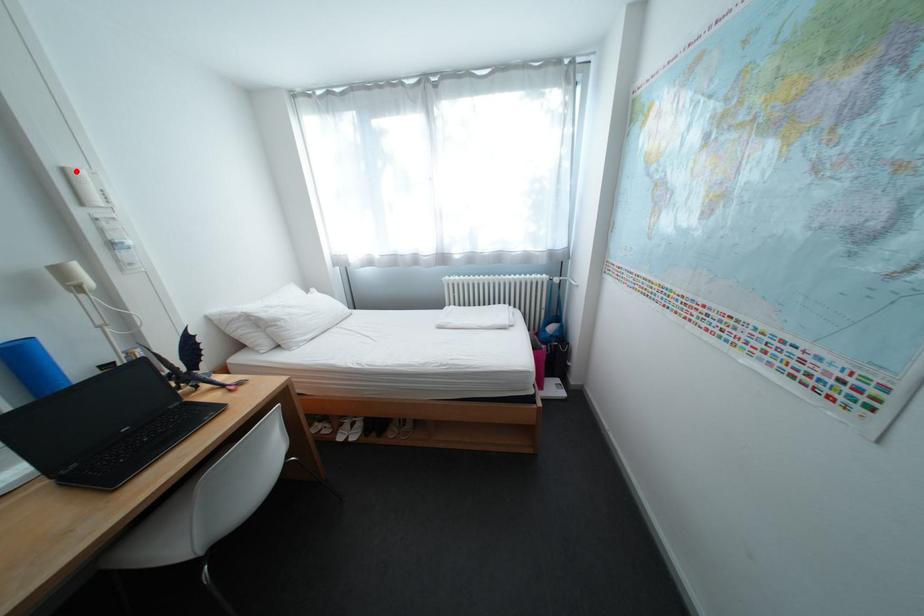
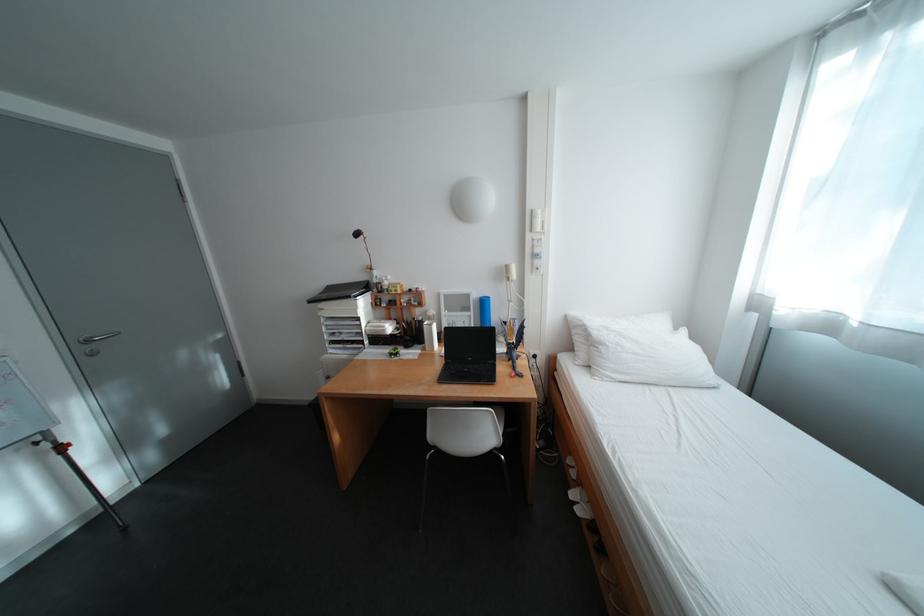
Question: I am providing you with two images of the same scene from different viewpoints. A red point is marked on the first image. At the location where the point appears in image 1, is it still visible in image 2?

Choices:
 (A) Yes
 (B) No

Answer: (A)